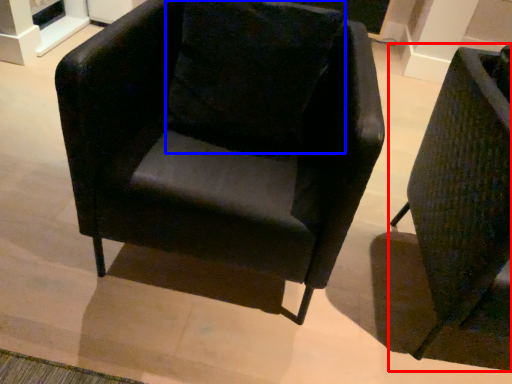
Question: Which of the following is the farthest to the observer, chair (highlighted by a red box) or pillow (highlighted by a blue box)?

Choices:
 (A) chair
 (B) pillow

Answer: (B)